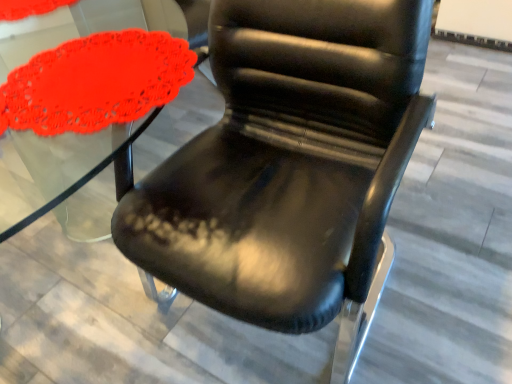
This screenshot has height=384, width=512. Find the location of `free space to the right of black leather chair at center`. free space to the right of black leather chair at center is located at coordinates (446, 250).